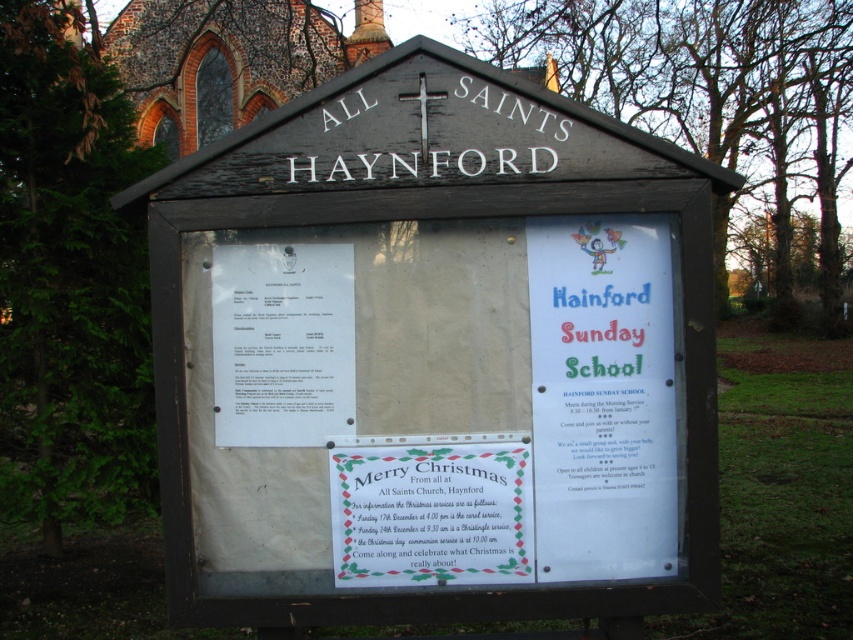
Question: Is white paper poster at center below white paper at left?

Choices:
 (A) yes
 (B) no

Answer: (A)

Question: Does white paper poster at center have a smaller size compared to white paper sign at center?

Choices:
 (A) no
 (B) yes

Answer: (A)

Question: Observing the image, what is the correct spatial positioning of white paper poster at center in reference to white paper sign at center?

Choices:
 (A) right
 (B) left

Answer: (A)

Question: Among these points, which one is nearest to the camera?

Choices:
 (A) (338, 531)
 (B) (329, 266)
 (C) (670, 474)

Answer: (B)

Question: Which is nearer to the white paper poster at center?

Choices:
 (A) white paper sign at center
 (B) white paper at left

Answer: (A)

Question: Which object appears farthest from the camera in this image?

Choices:
 (A) white paper at left
 (B) white paper sign at center
 (C) white paper poster at center

Answer: (A)